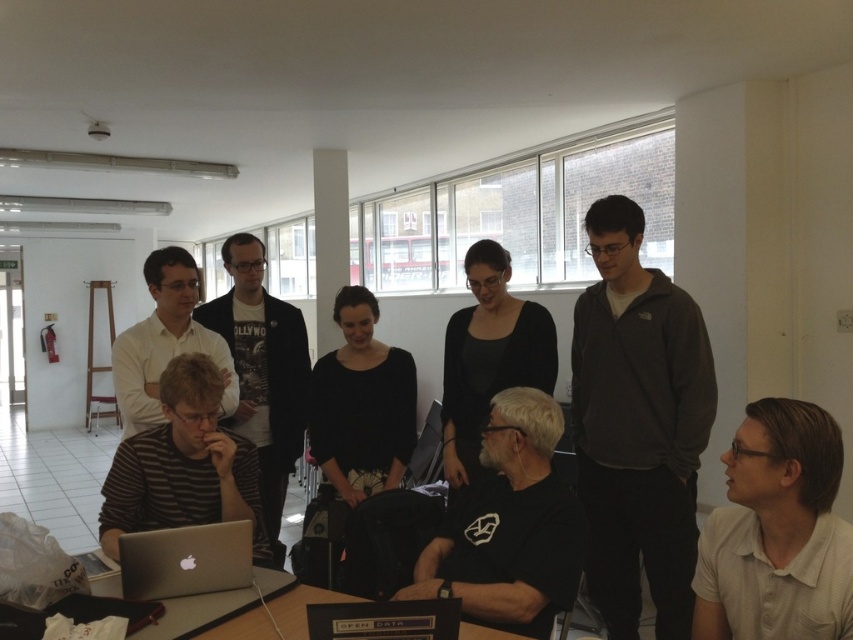
Question: Which object appears farthest from the camera in this image?

Choices:
 (A) dark gray fleece at upper right
 (B) black matte shirt at center
 (C) silver metallic laptop at lower left
 (D) white matte shirt at lower right

Answer: (B)

Question: Which object is positioned farthest from the black matte t-shirt at center?

Choices:
 (A) dark gray fleece at upper right
 (B) black matte shirt at center
 (C) striped fabric shirt at left

Answer: (C)

Question: Which object is the farthest from the striped cotton shirt at center?

Choices:
 (A) black matte t-shirt at center
 (B) matte black laptop at lower center
 (C) dark gray fleece at upper right

Answer: (B)

Question: Can you confirm if white matte shirt at center is wider than silver metallic laptop at lower left?

Choices:
 (A) yes
 (B) no

Answer: (A)

Question: From the image, what is the correct spatial relationship of striped cotton shirt at center in relation to black matte shirt at center?

Choices:
 (A) below
 (B) above

Answer: (A)

Question: In this image, where is dark gray fleece at upper right located relative to black matte t-shirt at center?

Choices:
 (A) above
 (B) below

Answer: (A)